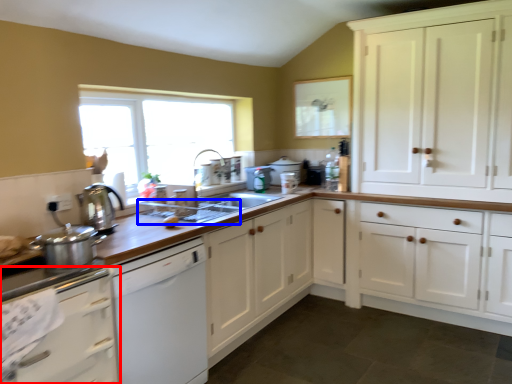
Question: Which object is closer to the camera taking this photo, cabinetry (highlighted by a red box) or appliance (highlighted by a blue box)?

Choices:
 (A) cabinetry
 (B) appliance

Answer: (A)